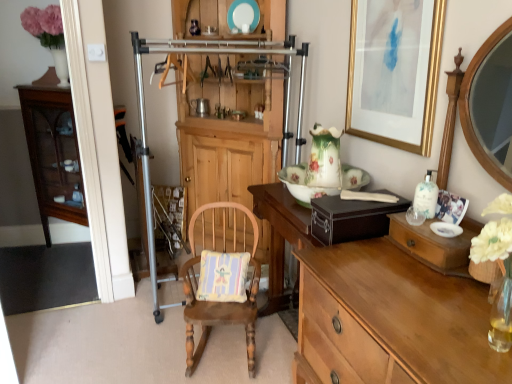
The width and height of the screenshot is (512, 384). In order to click on vacant space situated on the left part of wooden dresser at center in this screenshot , I will do `click(103, 319)`.